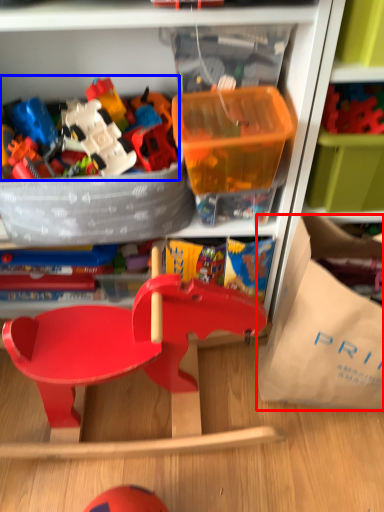
Question: Which of the following is the closest to the observer, paper bag (highlighted by a red box) or toy (highlighted by a blue box)?

Choices:
 (A) paper bag
 (B) toy

Answer: (A)